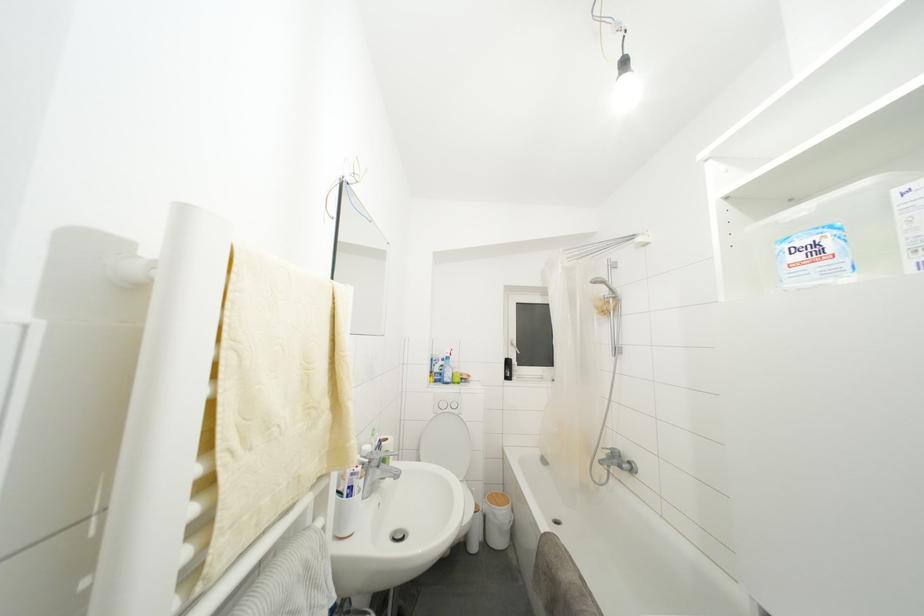
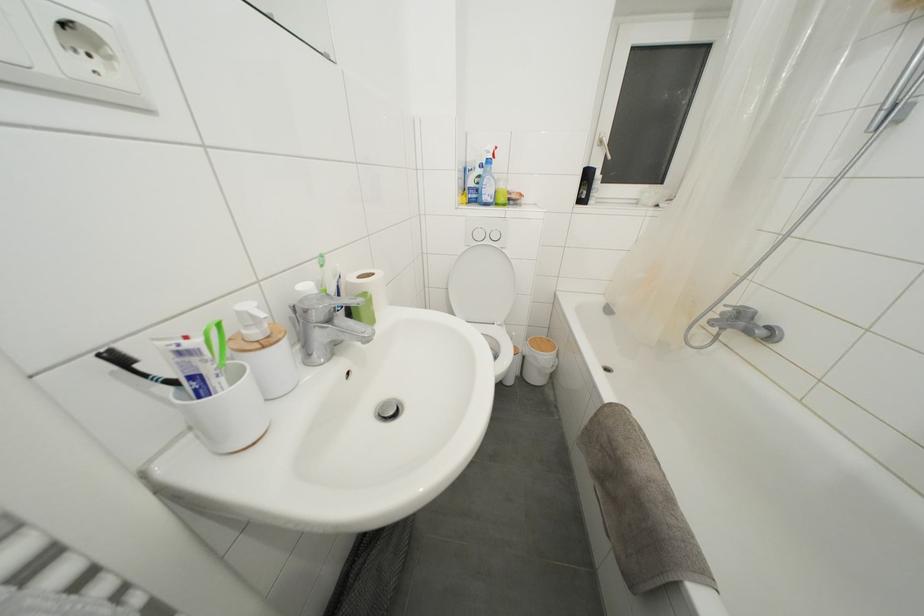
The point at (611, 460) is marked in the first image. Where is the corresponding point in the second image?

(726, 318)